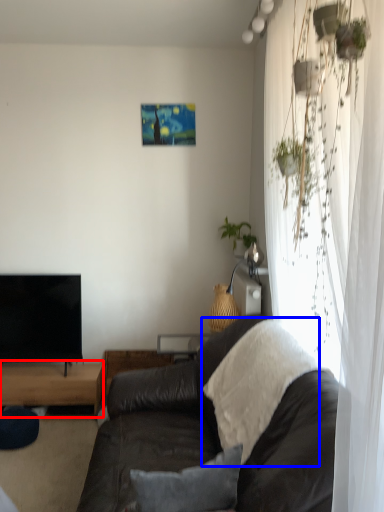
Question: Which object appears farthest to the camera in this image, table (highlighted by a red box) or blanket (highlighted by a blue box)?

Choices:
 (A) table
 (B) blanket

Answer: (A)